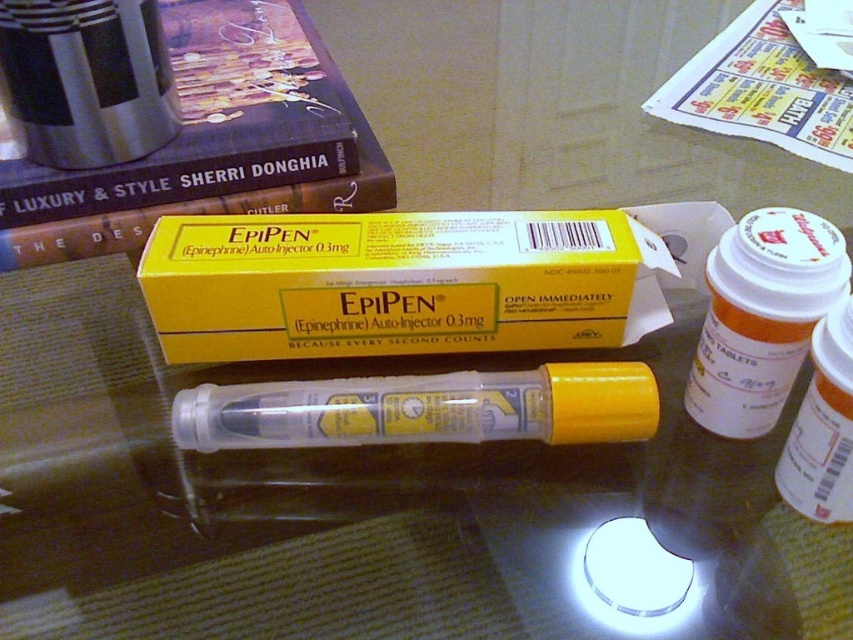
Is yellow cardboard box at center bigger than hardcover book at upper left?

Incorrect, yellow cardboard box at center is not larger than hardcover book at upper left.

You are a GUI agent. You are given a task and a screenshot of the screen. Output one action in this format:
    pyautogui.click(x=<x>, y=<y>)
    Task: Click on the yellow cardboard box at center
    This screenshot has height=640, width=853.
    Given the screenshot: What is the action you would take?
    pyautogui.click(x=399, y=284)

Does point (564, 228) lie behind point (306, 198)?

No.

Identify the location of yellow cardboard box at center. Image resolution: width=853 pixels, height=640 pixels. (399, 284).